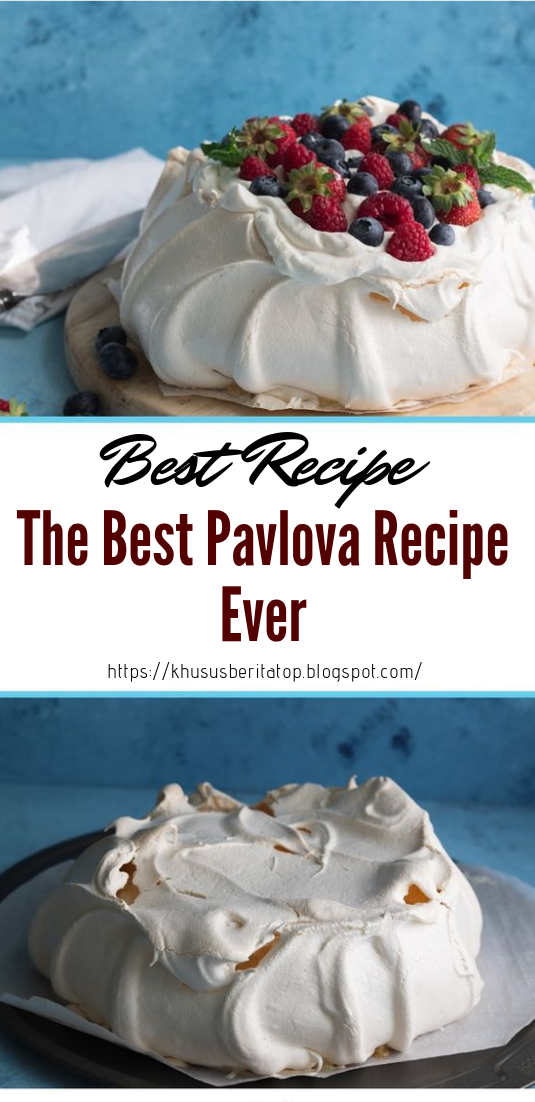
The width and height of the screenshot is (535, 1102). In order to click on sheet in this screenshot , I will do `click(496, 1034)`.